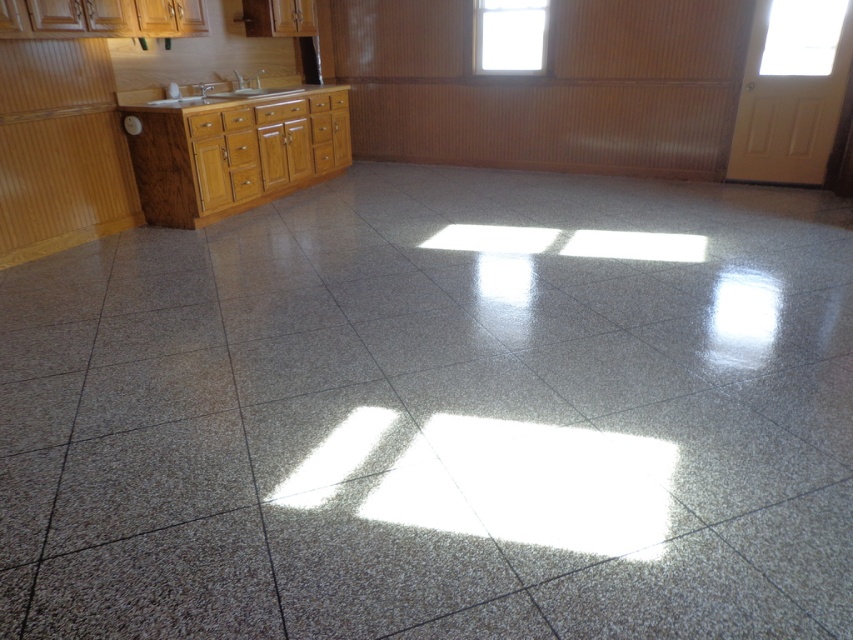
You are a cleaning robot in a kitchen. You need to clean the transparent glass door at upper right and the matte silver sink at upper left. Which one should you clean first if you want to start with the object closer to you?

You should clean the transparent glass door at upper right first because it is closer to you than the matte silver sink at upper left.

You are standing in the kitchen and want to place a small decorative item on the floor. There are two points marked on the floor at coordinates point (834, 12) and point (229, 92). Which point is closer to you where you can place the item?

Point (834, 12) is closer to the viewer than point (229, 92), so you can place the item there.

You are trying to decide whether to hang a decorative mirror on the wall between the transparent glass door at upper right and the matte silver sink at upper left. The mirror requires at least 1.2 meters of vertical space. Can the space between these two objects accommodate the mirror?

The transparent glass door at upper right is taller than the matte silver sink at upper left, so the vertical space between them is sufficient to accommodate a mirror requiring 1.2 meters of vertical space.